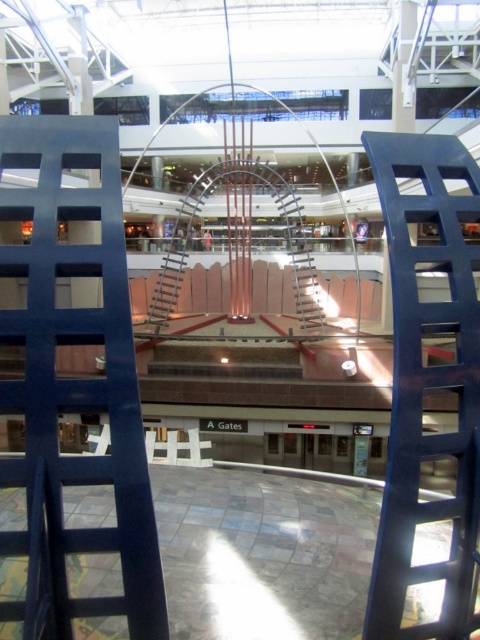
How far apart are polished stone floor at center and blue metallic ladder at center?

A distance of 5.12 meters exists between polished stone floor at center and blue metallic ladder at center.

Which is behind, point (288, 538) or point (408, 502)?

The point (288, 538) is more distant.

Does point (240, 476) lie behind point (443, 614)?

Yes, it is.

The height and width of the screenshot is (640, 480). Identify the location of polished stone floor at center. 262,556.

Consider the image. Does blue matte ladder at center appear over polished stone floor at center?

Correct, blue matte ladder at center is located above polished stone floor at center.

Between point (94, 378) and point (95, 596), which one is positioned in front?

Point (95, 596) is more forward.

The height and width of the screenshot is (640, 480). In order to click on blue matte ladder at center in this screenshot , I will do `click(73, 380)`.

Which is above, blue matte ladder at center or blue metallic ladder at center?

blue matte ladder at center is higher up.

Between blue matte ladder at center and blue metallic ladder at center, which one has more height?

With more height is blue metallic ladder at center.

Measure the distance between blue matte ladder at center and camera.

They are 5.11 meters apart.

In order to click on blue matte ladder at center in this screenshot , I will do coord(73,380).